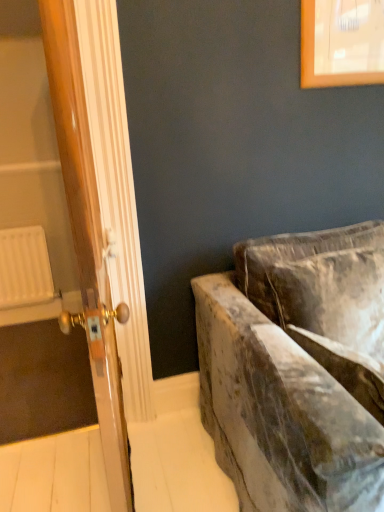
In order to face white plastic radiator at left, should I rotate leftwards or rightwards?

You should look left and rotate roughly 22.188 degrees.

Find the location of a particular element. wooden door at left is located at coordinates tap(88, 241).

The height and width of the screenshot is (512, 384). Identify the location of velvet couch at right. (297, 369).

Is velvet couch at right positioned in front of wooden door at left?

Yes, velvet couch at right is closer to the viewer.

In the scene shown: Is the surface of velvet couch at right in direct contact with wooden door at left?

velvet couch at right and wooden door at left are clearly separated.

Between velvet couch at right and wooden door at left, which one has smaller width?

Thinner between the two is wooden door at left.

Which is behind, point (369, 368) or point (82, 97)?

The point (82, 97) is farther from the camera.

Considering the relative sizes of white plastic radiator at left and velvet couch at right in the image provided, is white plastic radiator at left shorter than velvet couch at right?

Yes, white plastic radiator at left is shorter than velvet couch at right.

Would you consider white plastic radiator at left to be distant from velvet couch at right?

white plastic radiator at left is far away from velvet couch at right.

Could you tell me if white plastic radiator at left is turned towards velvet couch at right?

No.

Considering the positions of points (110, 385) and (23, 290), is point (110, 385) farther from camera compared to point (23, 290)?

No, it is not.

From the image's perspective, does wooden door at left appear higher than white plastic radiator at left?

Indeed, from the image's perspective, wooden door at left is shown above white plastic radiator at left.

Where is `door located in front of the white plastic radiator at left`? door located in front of the white plastic radiator at left is located at coordinates (88, 241).

Does wooden door at left have a lesser width compared to white plastic radiator at left?

In fact, wooden door at left might be wider than white plastic radiator at left.

Based on their sizes in the image, would you say white plastic radiator at left is bigger or smaller than wooden door at left?

Considering their sizes, white plastic radiator at left takes up less space than wooden door at left.

Consider the image. Is there a large distance between white plastic radiator at left and wooden door at left?

Yes, white plastic radiator at left and wooden door at left are quite far apart.

From a real-world perspective, who is located lower, white plastic radiator at left or wooden door at left?

white plastic radiator at left is physically lower.

How far apart are white plastic radiator at left and wooden door at left?

white plastic radiator at left is 1.81 meters away from wooden door at left.

Can we say wooden door at left lies outside velvet couch at right?

Yes, wooden door at left is outside of velvet couch at right.

Measure the distance between wooden door at left and velvet couch at right.

A distance of 22.61 inches exists between wooden door at left and velvet couch at right.

Is wooden door at left wider or thinner than velvet couch at right?

Clearly, wooden door at left has less width compared to velvet couch at right.

Does wooden door at left appear on the left side of velvet couch at right?

Indeed, wooden door at left is positioned on the left side of velvet couch at right.

From the image's perspective, would you say velvet couch at right is shown under white plastic radiator at left?

Yes.

Are velvet couch at right and white plastic radiator at left located far from each other?

Absolutely, velvet couch at right is distant from white plastic radiator at left.

From a real-world perspective, is velvet couch at right positioned over white plastic radiator at left based on gravity?

Yes, from a real-world perspective, velvet couch at right is above white plastic radiator at left.

Identify the location of studio couch below the wooden door at left (from a real-world perspective). Image resolution: width=384 pixels, height=512 pixels. (297, 369).

What are the coordinates of `studio couch on the right of the white plastic radiator at left` in the screenshot? It's located at (297, 369).

When comparing their distances from velvet couch at right, does white plastic radiator at left or wooden door at left seem closer?

wooden door at left.

In the scene shown: From the image, which object appears to be farther from wooden door at left, white plastic radiator at left or velvet couch at right?

white plastic radiator at left is further to wooden door at left.

Estimate the real-world distances between objects in this image. Which object is closer to velvet couch at right, wooden door at left or white plastic radiator at left?

wooden door at left is positioned closer to the anchor velvet couch at right.

Estimate the real-world distances between objects in this image. Which object is further from white plastic radiator at left, velvet couch at right or wooden door at left?

velvet couch at right lies further to white plastic radiator at left than the other object.

Estimate the real-world distances between objects in this image. Which object is closer to wooden door at left, velvet couch at right or white plastic radiator at left?

velvet couch at right.

Estimate the real-world distances between objects in this image. Which object is closer to white plastic radiator at left, wooden door at left or velvet couch at right?

wooden door at left lies closer to white plastic radiator at left than the other object.

The height and width of the screenshot is (512, 384). Find the location of `door between velvet couch at right and white plastic radiator at left along the z-axis`. door between velvet couch at right and white plastic radiator at left along the z-axis is located at coordinates (88, 241).